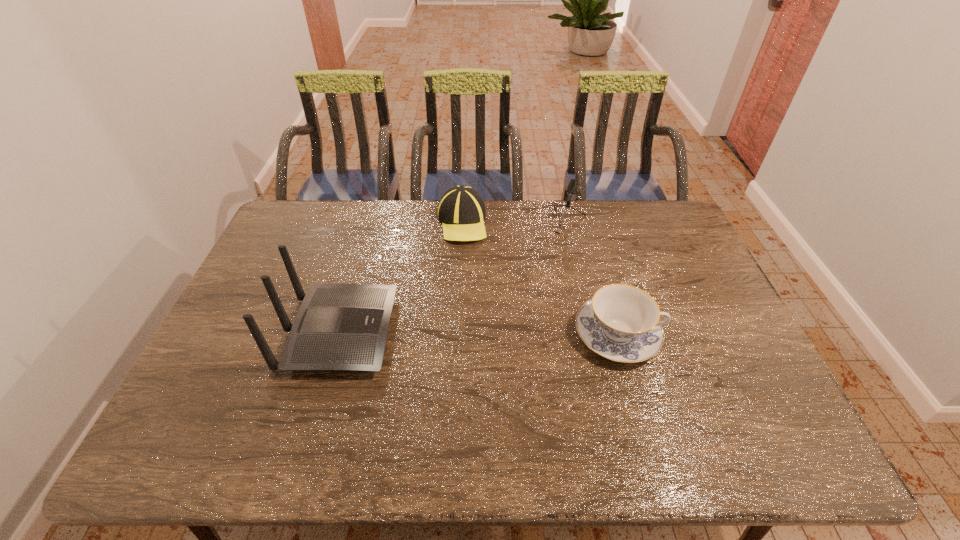
I want to click on vacant region at the far right corner of the desktop, so click(x=660, y=211).

This screenshot has height=540, width=960. I want to click on free point between the leftmost object and the second object from left to right, so click(400, 278).

Where is `free space between the third object from right to left and the chinaware`? This screenshot has height=540, width=960. free space between the third object from right to left and the chinaware is located at coordinates (540, 279).

Identify the location of unoccupied position between the router and the third object from right to left. (400, 278).

Identify the location of unoccupied area between the microphone and the chinaware. The height and width of the screenshot is (540, 960). (588, 280).

Where is `empty location between the microphone and the chinaware`? This screenshot has width=960, height=540. empty location between the microphone and the chinaware is located at coordinates (588, 280).

Image resolution: width=960 pixels, height=540 pixels. I want to click on free space between the baseball cap and the chinaware, so pyautogui.click(x=540, y=279).

At what (x,y) coordinates should I click in order to perform the action: click on vacant space in between the chinaware and the baseball cap. Please return your answer as a coordinate pair (x, y). This screenshot has width=960, height=540. Looking at the image, I should click on coord(540,279).

You are a GUI agent. You are given a task and a screenshot of the screen. Output one action in this format:
    pyautogui.click(x=<x>, y=<y>)
    Task: Click on the free space between the baseball cap and the microphone
    This screenshot has width=960, height=540.
    Given the screenshot: What is the action you would take?
    tap(511, 224)

Identify the location of free space between the microphone and the router. (449, 279).